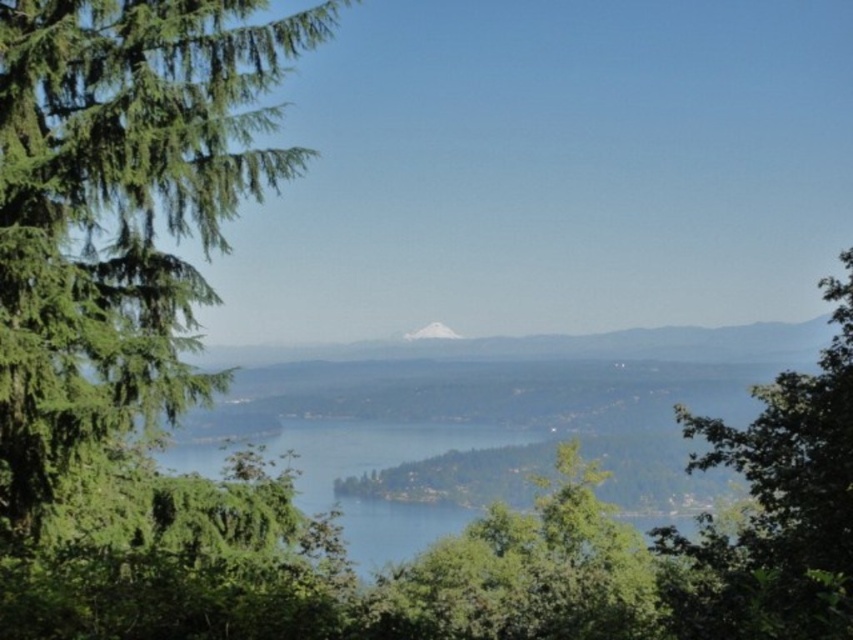
Is green leafy tree at left bigger than green leafy tree at right?

Incorrect, green leafy tree at left is not larger than green leafy tree at right.

Does green leafy tree at left appear under green leafy tree at right?

No.

Is point (105, 353) positioned in front of point (714, 573)?

No.

This screenshot has width=853, height=640. Find the location of `green leafy tree at left`. green leafy tree at left is located at coordinates coord(119,216).

Does green leafy tree at left appear on the left side of green leafy tree at center?

Yes, green leafy tree at left is to the left of green leafy tree at center.

Can you confirm if green leafy tree at left is positioned to the right of green leafy tree at center?

Incorrect, green leafy tree at left is not on the right side of green leafy tree at center.

Image resolution: width=853 pixels, height=640 pixels. I want to click on green leafy tree at left, so click(119, 216).

This screenshot has width=853, height=640. What are the coordinates of `green leafy tree at left` in the screenshot? It's located at (119, 216).

Between point (550, 568) and point (445, 346), which one is positioned in front?

Positioned in front is point (550, 568).

Is point (498, 525) positioned in front of point (265, 349)?

Yes, it is.

Find the location of a particular element. The height and width of the screenshot is (640, 853). green leafy tree at center is located at coordinates coord(527,572).